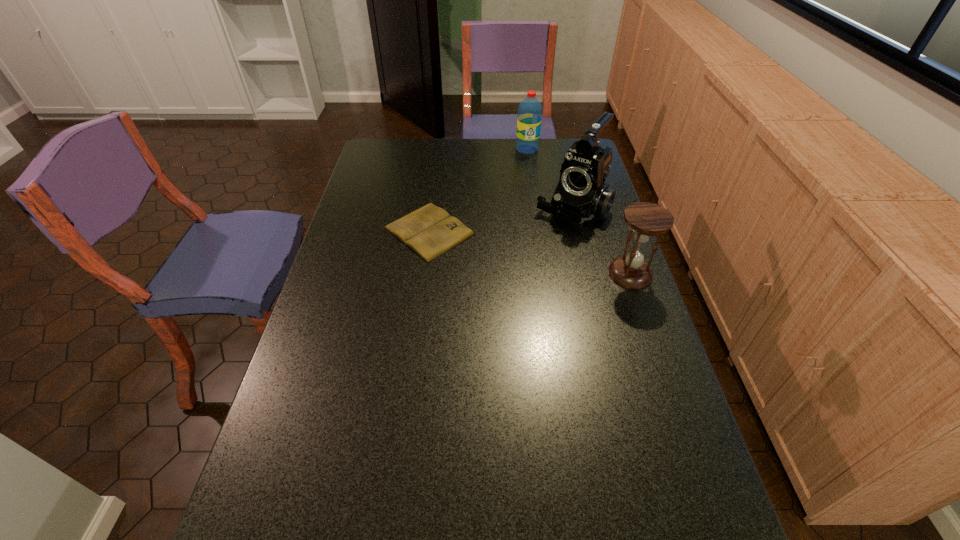
You are a GUI agent. You are given a task and a screenshot of the screen. Output one action in this format:
    pyautogui.click(x=<x>, y=<y>)
    Task: Click on the third closest object to the farthest object
    The height and width of the screenshot is (540, 960).
    Given the screenshot: What is the action you would take?
    646,219

This screenshot has width=960, height=540. What are the coordinates of `the second closest object to the water bottle` in the screenshot? It's located at tap(430, 231).

The width and height of the screenshot is (960, 540). In order to click on vacant space that satisfies the following two spatial constraints: 1. on the front side of the leftmost object; 2. on the left side of the hourglass in this screenshot , I will do `click(423, 274)`.